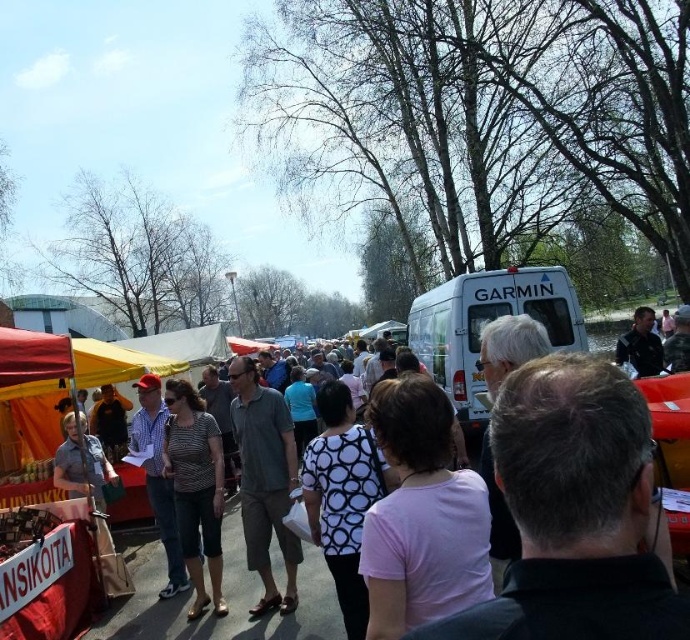
Question: From the image, what is the correct spatial relationship of white matte van at upper center in relation to striped fabric shirt at center?

Choices:
 (A) below
 (B) above

Answer: (B)

Question: Which of the following is the farthest from the observer?

Choices:
 (A) (486, 291)
 (B) (210, 426)

Answer: (A)

Question: Is white matte van at upper center behind striped fabric shirt at center?

Choices:
 (A) yes
 (B) no

Answer: (A)

Question: Does white matte van at upper center appear on the right side of striped fabric shirt at center?

Choices:
 (A) yes
 (B) no

Answer: (A)

Question: Which object appears farthest from the camera in this image?

Choices:
 (A) striped fabric shirt at center
 (B) white matte van at upper center

Answer: (B)

Question: Which of the following is the closest to the observer?

Choices:
 (A) striped fabric shirt at center
 (B) white matte van at upper center

Answer: (A)